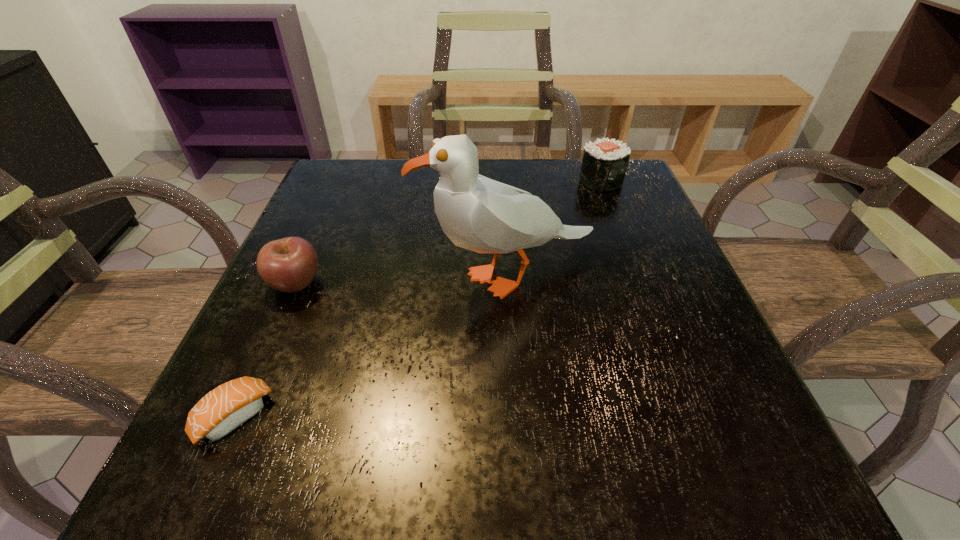
At what (x,y) coordinates should I click in order to perform the action: click on free space located 0.370m on the left of the taller sushi. Please return your answer as a coordinate pair (x, y). This screenshot has width=960, height=540. Looking at the image, I should click on (423, 181).

Where is `vacant position located on the side of the apple with the unique marking`? vacant position located on the side of the apple with the unique marking is located at coordinates tap(529, 283).

The image size is (960, 540). In order to click on free space located on the right of the nearer sushi in this screenshot , I will do `click(378, 417)`.

You are a GUI agent. You are given a task and a screenshot of the screen. Output one action in this format:
    pyautogui.click(x=<x>, y=<y>)
    Task: Click on the object present at the far edge
    This screenshot has height=540, width=960.
    Given the screenshot: What is the action you would take?
    pyautogui.click(x=604, y=164)

Where is `object that is at the near edge`? This screenshot has height=540, width=960. object that is at the near edge is located at coordinates (228, 406).

Where is `apple that is at the left edge`? The image size is (960, 540). apple that is at the left edge is located at coordinates (289, 265).

Locate an element on the screen. The width and height of the screenshot is (960, 540). sushi that is at the left edge is located at coordinates (228, 406).

I want to click on object located at the right edge, so (x=604, y=164).

Find the location of a particular element. object positioned at the near left corner is located at coordinates click(x=228, y=406).

I want to click on object located at the far right corner, so click(604, 164).